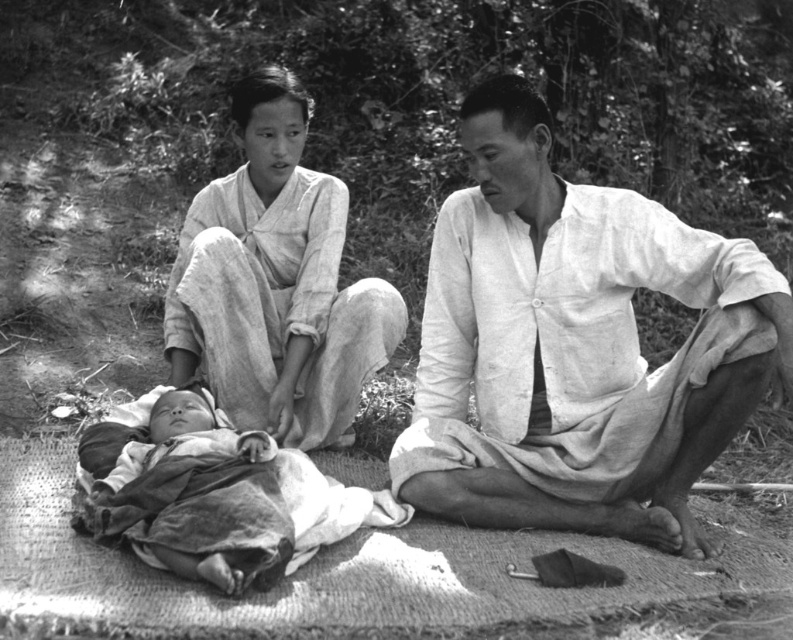
Does point (596, 342) come closer to viewer compared to point (324, 429)?

That is True.

Is light beige fabric shirt at center closer to the viewer compared to light beige fabric at upper left?

Yes, it is.

What do you see at coordinates (577, 346) in the screenshot?
I see `light beige fabric shirt at center` at bounding box center [577, 346].

The width and height of the screenshot is (793, 640). I want to click on light beige fabric shirt at center, so click(x=577, y=346).